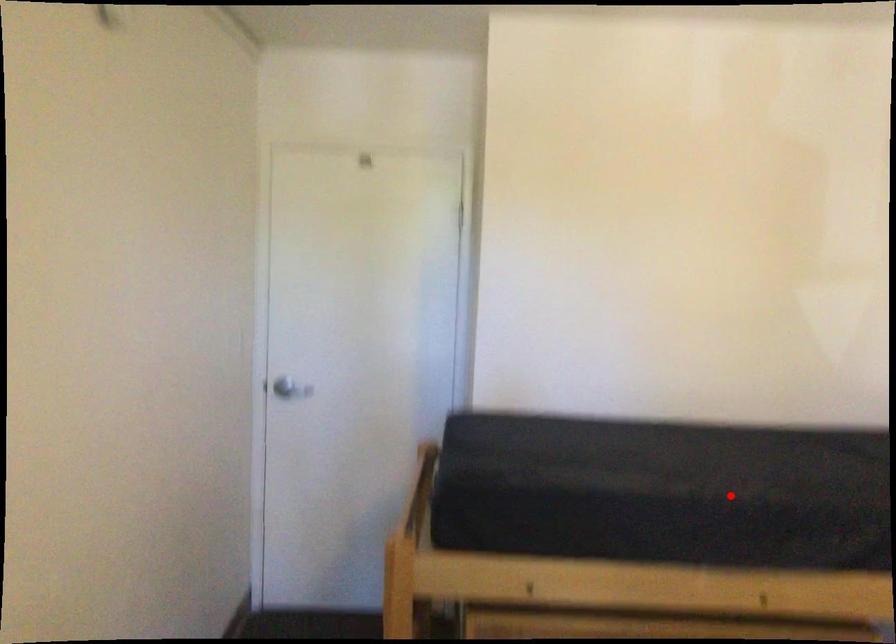
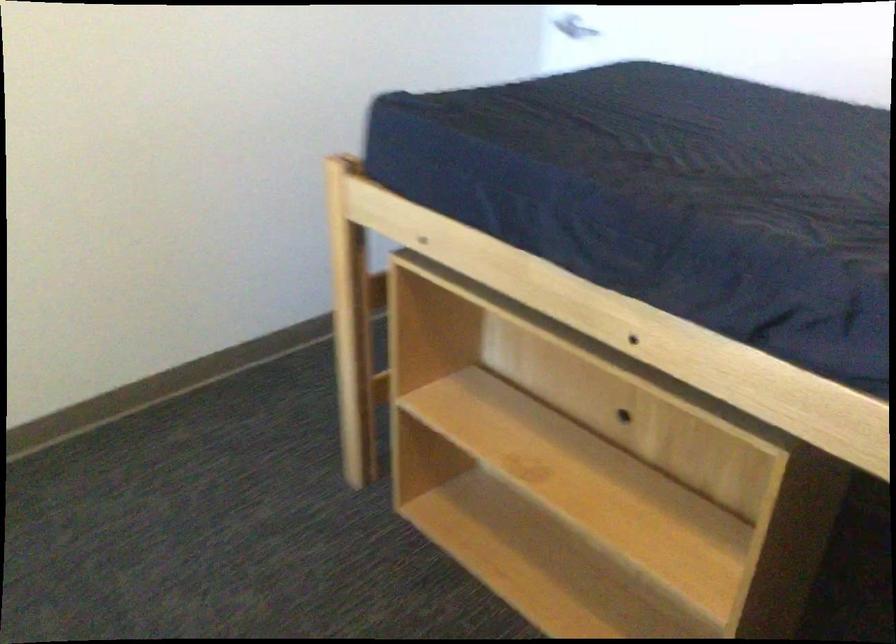
Question: I am providing you with two images of the same scene from different viewpoints. In image1, a red point is highlighted. Considering the same 3D point in image2, which of the following is correct?

Choices:
 (A) It is closer
 (B) It is farther

Answer: (A)